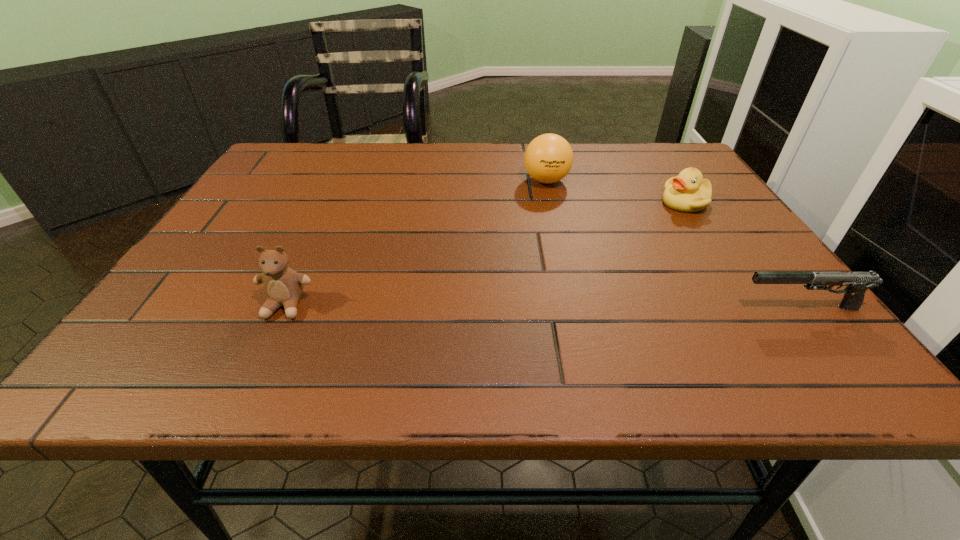
What are the coordinates of `blank area at the left edge` in the screenshot? It's located at (230, 219).

The image size is (960, 540). In order to click on free spot at the right edge of the desktop in this screenshot , I will do `click(726, 207)`.

This screenshot has height=540, width=960. In the image, there is a desktop. What are the coordinates of `vacant space at the far right corner` in the screenshot? It's located at (626, 145).

The height and width of the screenshot is (540, 960). What are the coordinates of `free spot between the ping-pong ball and the teddy bear` in the screenshot? It's located at (416, 243).

Image resolution: width=960 pixels, height=540 pixels. What are the coordinates of `free space between the duckling and the leftmost object` in the screenshot? It's located at [486, 254].

Identify the location of free space between the leftmost object and the gun. Image resolution: width=960 pixels, height=540 pixels. (543, 307).

At what (x,y) coordinates should I click in order to perform the action: click on free space between the gun and the teddy bear. Please return your answer as a coordinate pair (x, y). Looking at the image, I should click on (543, 307).

Find the location of a particular element. vacant space that is in between the leftmost object and the gun is located at coordinates (543, 307).

Locate an element on the screen. vacant point located between the ping-pong ball and the duckling is located at coordinates (615, 192).

Locate an element on the screen. The height and width of the screenshot is (540, 960). free area in between the duckling and the gun is located at coordinates (743, 255).